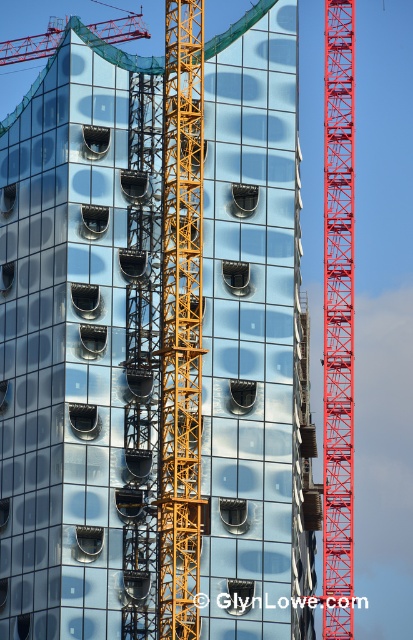
You are a construction worker standing at the base of the yellow metallic crane at center. You need to move to the nearest crane. Which direction should you go?

The nearest crane is the yellow metallic crane at center itself, so you are already at the nearest crane.

You are an engineer inspecting the construction site. You notice two cranes, the metallic red crane at right and the red metal crane at upper left. Which one is bigger in size?

The metallic red crane at right is larger in size compared to the red metal crane at upper left.